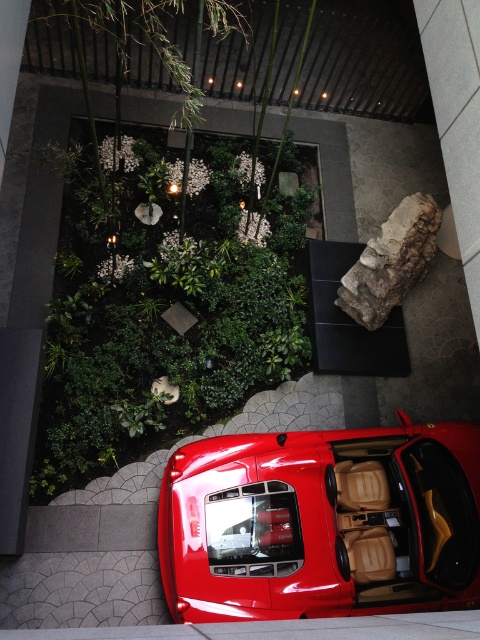
Between green leafy plant at center and glossy red car at center, which one is positioned lower?

glossy red car at center

Does green leafy plant at center have a lesser width compared to glossy red car at center?

In fact, green leafy plant at center might be wider than glossy red car at center.

Which is behind, point (88, 289) or point (396, 504)?

Point (88, 289)

Locate an element on the screen. green leafy plant at center is located at coordinates (167, 323).